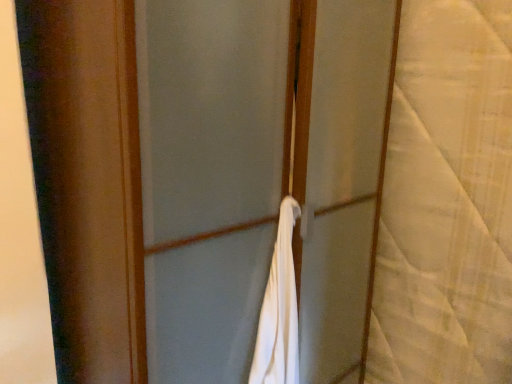
Question: Considering the positions of white fabric at center and white textured fabric at right in the image, is white fabric at center wider or thinner than white textured fabric at right?

Choices:
 (A) wide
 (B) thin

Answer: (A)

Question: From the image's perspective, relative to white textured fabric at right, is white fabric at center above or below?

Choices:
 (A) above
 (B) below

Answer: (B)

Question: Relative to white textured fabric at right, is white fabric at center in front or behind?

Choices:
 (A) front
 (B) behind

Answer: (A)

Question: Based on their sizes in the image, would you say white textured fabric at right is bigger or smaller than white fabric at center?

Choices:
 (A) small
 (B) big

Answer: (A)

Question: In terms of height, does white textured fabric at right look taller or shorter compared to white fabric at center?

Choices:
 (A) short
 (B) tall

Answer: (A)

Question: Considering the positions of point (414, 135) and point (150, 54), is point (414, 135) closer or farther from the camera than point (150, 54)?

Choices:
 (A) farther
 (B) closer

Answer: (A)

Question: Based on their positions, is white textured fabric at right located to the left or right of white fabric at center?

Choices:
 (A) left
 (B) right

Answer: (B)